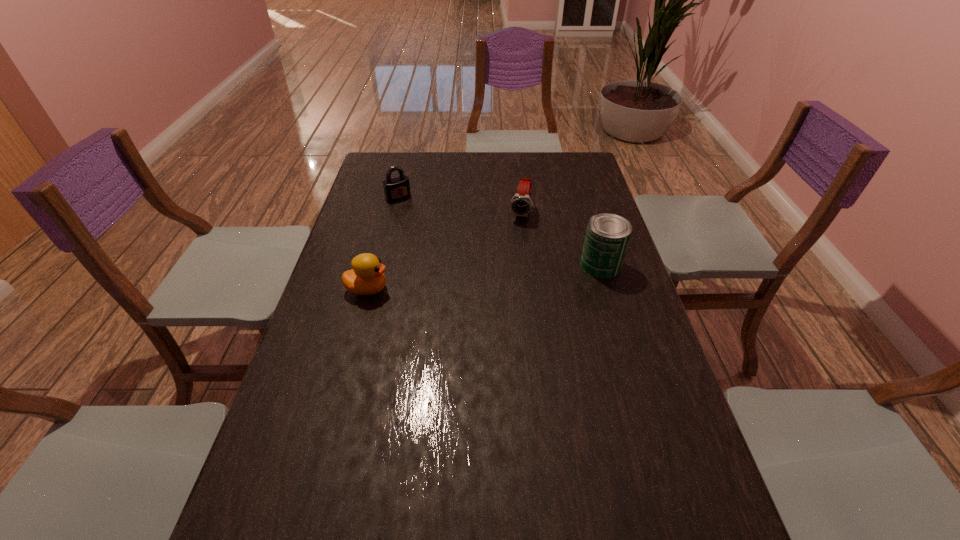
The image size is (960, 540). I want to click on free spot on the desktop that is between the duckling and the third farthest object and is positioned on the front of the farthest object near the keyhole, so click(x=462, y=280).

The image size is (960, 540). Find the location of `free space on the desktop that is between the duckling and the second nearest object and is positioned on the face of the second object from right to left`. free space on the desktop that is between the duckling and the second nearest object and is positioned on the face of the second object from right to left is located at coordinates (501, 275).